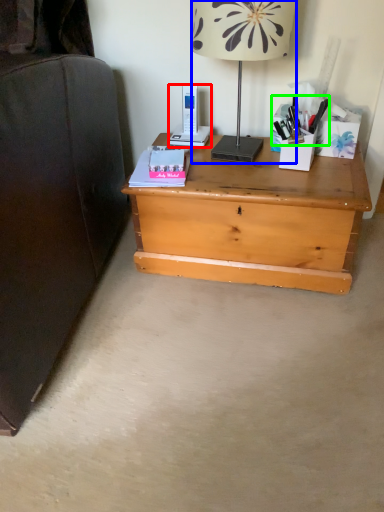
Question: Based on their relative distances, which object is farther from gadget (highlighted by a red box)? Choose from lamp (highlighted by a blue box) and stationery (highlighted by a green box).

Choices:
 (A) lamp
 (B) stationery

Answer: (B)